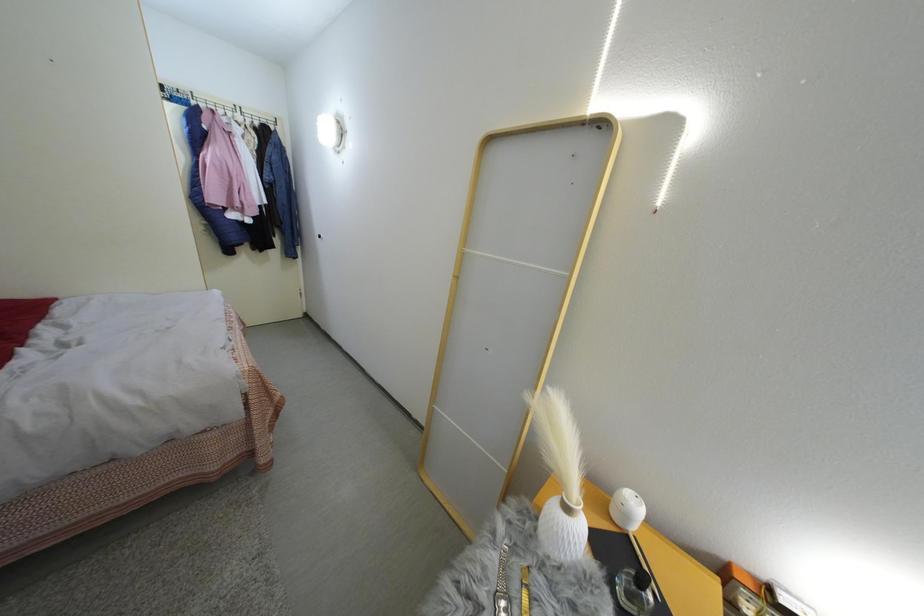
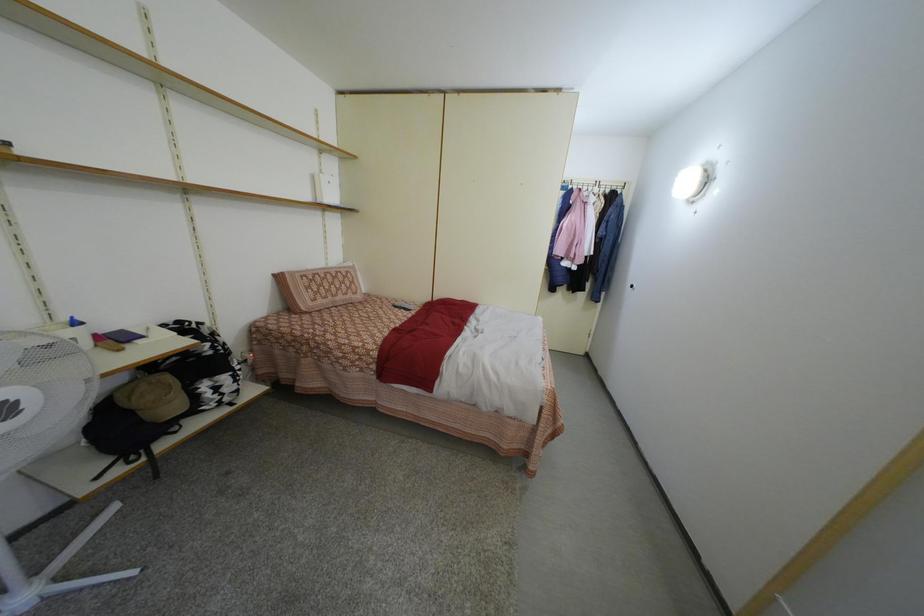
Question: The camera is either moving clockwise (left) or counter-clockwise (right) around the object. The first image is from the beginning of the video and the second image is from the end. Is the camera moving left or right when shooting the video?

Choices:
 (A) Left
 (B) Right

Answer: (B)